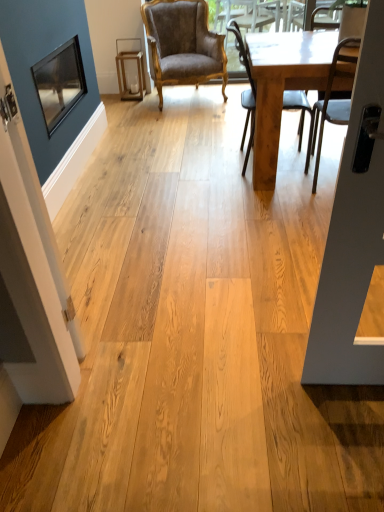
Image resolution: width=384 pixels, height=512 pixels. Identify the location of free space in front of light brown wooden chair at center, which is the 2th chair in left-to-right order. (257, 201).